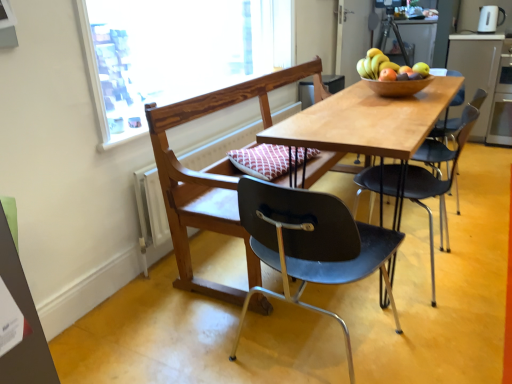
This screenshot has height=384, width=512. I want to click on vacant region to the right of wooden table at center, so click(478, 210).